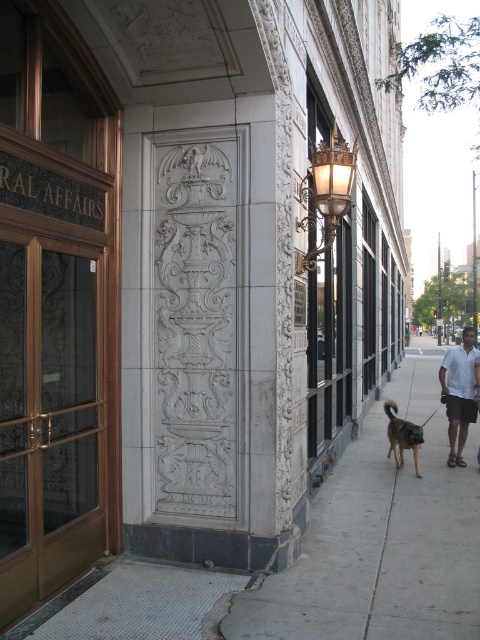
Question: Does white cotton shirt at right appear on the left side of brown fur dog at lower center?

Choices:
 (A) yes
 (B) no

Answer: (B)

Question: Among these objects, which one is nearest to the camera?

Choices:
 (A) gray concrete sidewalk at center
 (B) white cotton shirt at right

Answer: (A)

Question: Which is farther from the gray concrete sidewalk at center?

Choices:
 (A) brown fur dog at lower center
 (B) white cotton shirt at right

Answer: (A)

Question: Does white cotton shirt at right lie in front of brown fur dog at lower center?

Choices:
 (A) no
 (B) yes

Answer: (A)

Question: Estimate the real-world distances between objects in this image. Which object is closer to the gray concrete sidewalk at center?

Choices:
 (A) white cotton shirt at right
 (B) brown fur dog at lower center

Answer: (A)

Question: Is gray concrete sidewalk at center below brown fur dog at lower center?

Choices:
 (A) yes
 (B) no

Answer: (A)